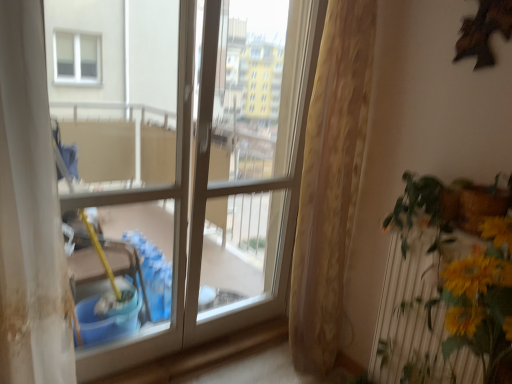
Question: Is clear glass window at center thinner than yellow artificial flowers at right?

Choices:
 (A) yes
 (B) no

Answer: (A)

Question: Considering the relative positions of clear glass window at center and yellow artificial flowers at right in the image provided, is clear glass window at center to the right of yellow artificial flowers at right from the viewer's perspective?

Choices:
 (A) no
 (B) yes

Answer: (A)

Question: Does clear glass window at center lie in front of yellow artificial flowers at right?

Choices:
 (A) no
 (B) yes

Answer: (A)

Question: From a real-world perspective, is clear glass window at center on yellow artificial flowers at right?

Choices:
 (A) no
 (B) yes

Answer: (B)

Question: Would you consider clear glass window at center to be distant from yellow artificial flowers at right?

Choices:
 (A) no
 (B) yes

Answer: (A)

Question: In the image, is white glossy screen door at center positioned in front of or behind beige textured curtain at center?

Choices:
 (A) behind
 (B) front

Answer: (B)

Question: Is white glossy screen door at center bigger or smaller than beige textured curtain at center?

Choices:
 (A) small
 (B) big

Answer: (B)

Question: In terms of width, does white glossy screen door at center look wider or thinner when compared to beige textured curtain at center?

Choices:
 (A) thin
 (B) wide

Answer: (A)

Question: From a real-world perspective, is white glossy screen door at center physically located above or below beige textured curtain at center?

Choices:
 (A) above
 (B) below

Answer: (A)

Question: Is point (339, 107) closer or farther from the camera than point (373, 360)?

Choices:
 (A) farther
 (B) closer

Answer: (B)

Question: Considering the positions of beige textured curtain at center and yellow artificial flowers at right in the image, is beige textured curtain at center wider or thinner than yellow artificial flowers at right?

Choices:
 (A) wide
 (B) thin

Answer: (A)

Question: Is beige textured curtain at center to the left or to the right of yellow artificial flowers at right in the image?

Choices:
 (A) left
 (B) right

Answer: (A)

Question: In terms of size, does beige textured curtain at center appear bigger or smaller than yellow artificial flowers at right?

Choices:
 (A) small
 (B) big

Answer: (B)

Question: From the image's perspective, relative to white glossy screen door at center, is yellow artificial flowers at right above or below?

Choices:
 (A) above
 (B) below

Answer: (B)

Question: Relative to white glossy screen door at center, is yellow artificial flowers at right in front or behind?

Choices:
 (A) behind
 (B) front

Answer: (B)